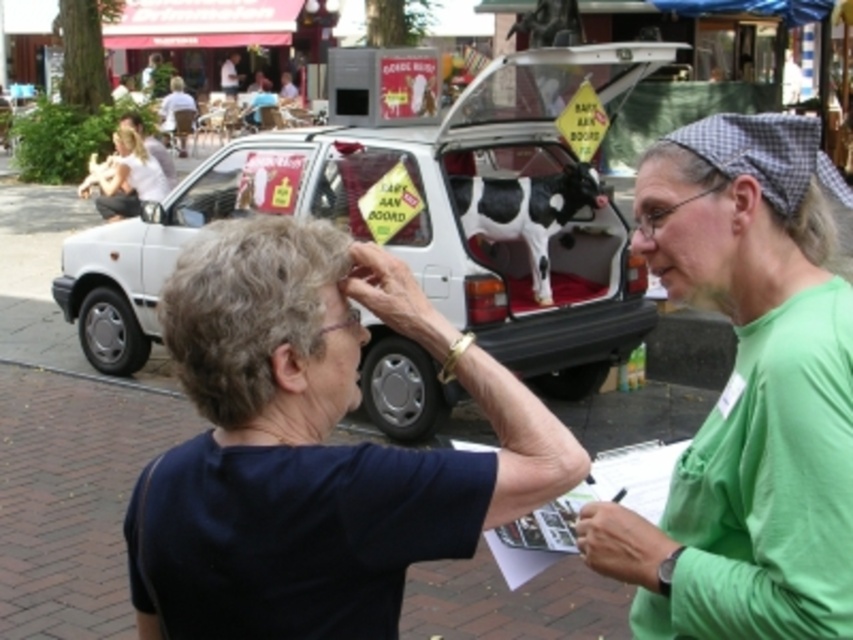
Does matte green shirt at center have a lesser height compared to smooth skin forehead at upper center?

No.

From the picture: Is matte green shirt at center positioned behind smooth skin forehead at upper center?

No, matte green shirt at center is in front of smooth skin forehead at upper center.

Image resolution: width=853 pixels, height=640 pixels. I want to click on matte green shirt at center, so click(747, 400).

Who is shorter, white cotton shirt at upper left or blonde hair at upper left?

blonde hair at upper left

Can you confirm if white cotton shirt at upper left is bigger than blonde hair at upper left?

Yes.

Who is more forward, [132,168] or [134,145]?

Positioned in front is point [132,168].

You are a GUI agent. You are given a task and a screenshot of the screen. Output one action in this format:
    pyautogui.click(x=<x>, y=<y>)
    Task: Click on the white cotton shirt at upper left
    Image resolution: width=853 pixels, height=640 pixels.
    Given the screenshot: What is the action you would take?
    pyautogui.click(x=125, y=177)

Is white matte car at center smaller than blonde hair at upper left?

No.

Is white matte car at center behind blonde hair at upper left?

No, it is not.

The height and width of the screenshot is (640, 853). In order to click on white matte car at center in this screenshot , I will do `click(416, 221)`.

Where is `white matte car at center`? white matte car at center is located at coordinates (416, 221).